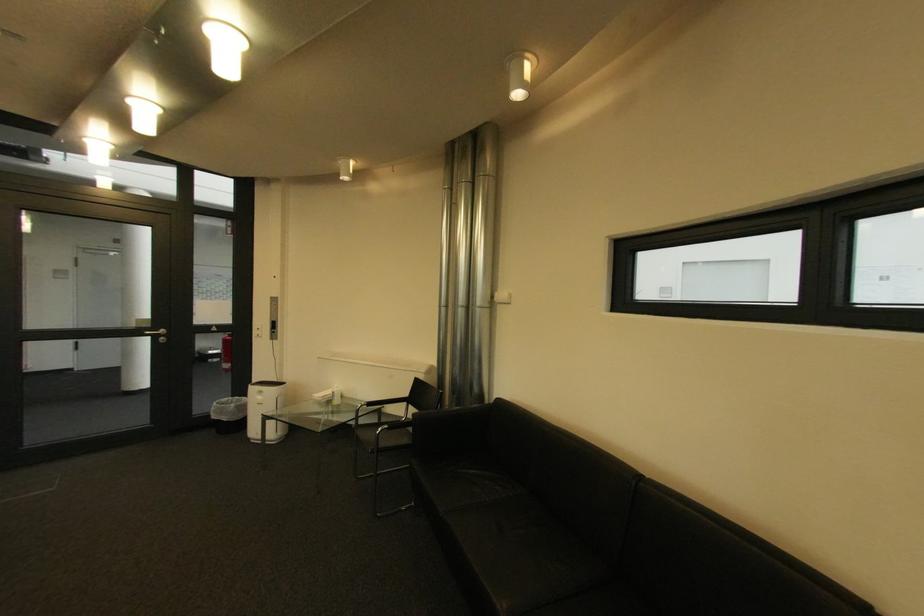
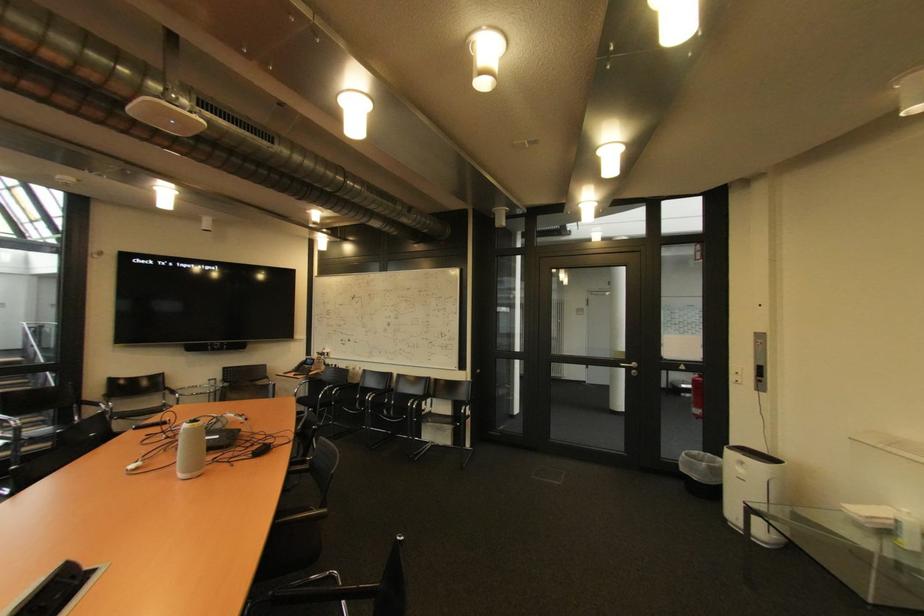
In the second image, find the point that corresponds to (223,418) in the first image.

(690, 471)